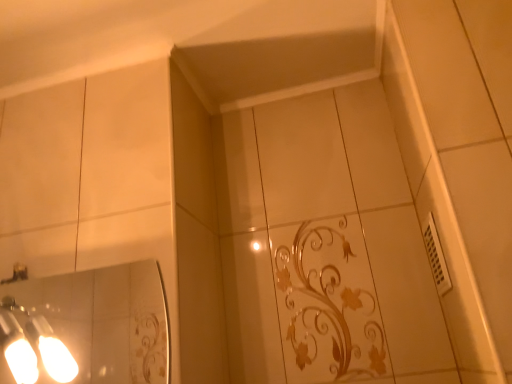
Describe the element at coordinates (436, 256) in the screenshot. The height and width of the screenshot is (384, 512). I see `white plastic vent at right` at that location.

Identify the location of white plastic vent at right. The width and height of the screenshot is (512, 384). (436, 256).

Describe the element at coordinates (31, 346) in the screenshot. I see `matte silver light fixture at left` at that location.

Where is `matte silver light fixture at left`? matte silver light fixture at left is located at coordinates (31, 346).

I want to click on white plastic vent at right, so click(x=436, y=256).

Considering the relative positions of white plastic vent at right and matte silver light fixture at left in the image provided, is white plastic vent at right to the left or to the right of matte silver light fixture at left?

From the image, it's evident that white plastic vent at right is to the right of matte silver light fixture at left.

Which object is further away from the camera taking this photo, white plastic vent at right or matte silver light fixture at left?

white plastic vent at right is more distant.

Which point is more forward, (x=435, y=227) or (x=53, y=359)?

The point (x=435, y=227) is more forward.

From the image's perspective, between white plastic vent at right and matte silver light fixture at left, who is located below?

From the image's view, matte silver light fixture at left is below.

From a real-world perspective, is white plastic vent at right on top of matte silver light fixture at left?

Correct, in the physical world, white plastic vent at right is higher than matte silver light fixture at left.

Can you confirm if white plastic vent at right is wider than matte silver light fixture at left?

No.

Can you confirm if white plastic vent at right is taller than matte silver light fixture at left?

No, white plastic vent at right is not taller than matte silver light fixture at left.

Does white plastic vent at right have a larger size compared to matte silver light fixture at left?

No, white plastic vent at right is not bigger than matte silver light fixture at left.

Is matte silver light fixture at left inside white plastic vent at right?

No.

Is white plastic vent at right positioned far away from matte silver light fixture at left?

No.

Is white plastic vent at right aimed at matte silver light fixture at left?

Yes, white plastic vent at right is oriented towards matte silver light fixture at left.

Can you tell me how much white plastic vent at right and matte silver light fixture at left differ in facing direction?

The angle between the facing direction of white plastic vent at right and the facing direction of matte silver light fixture at left is 88.4 degrees.

Looking at this image, how much distance is there between white plastic vent at right and matte silver light fixture at left?

white plastic vent at right and matte silver light fixture at left are 33.91 inches apart.

The height and width of the screenshot is (384, 512). Find the location of `electric outlet above the matte silver light fixture at left (from a real-world perspective)`. electric outlet above the matte silver light fixture at left (from a real-world perspective) is located at coordinates (436, 256).

Looking at this image, is matte silver light fixture at left to the left of white plastic vent at right from the viewer's perspective?

Yes.

Considering the positions of objects matte silver light fixture at left and white plastic vent at right in the image provided, who is behind, matte silver light fixture at left or white plastic vent at right?

Positioned behind is white plastic vent at right.

Is point (32, 365) more distant than point (432, 271)?

No.

From the image's perspective, would you say matte silver light fixture at left is shown under white plastic vent at right?

Indeed, from the image's perspective, matte silver light fixture at left is shown beneath white plastic vent at right.

From the picture: From a real-world perspective, who is located lower, matte silver light fixture at left or white plastic vent at right?

From a 3D spatial view, matte silver light fixture at left is below.

Is matte silver light fixture at left wider or thinner than white plastic vent at right?

Considering their sizes, matte silver light fixture at left looks broader than white plastic vent at right.

Who is taller, matte silver light fixture at left or white plastic vent at right?

With more height is matte silver light fixture at left.

Between matte silver light fixture at left and white plastic vent at right, which one has smaller size?

white plastic vent at right is smaller.

Would you say matte silver light fixture at left is outside white plastic vent at right?

Absolutely, matte silver light fixture at left is external to white plastic vent at right.

Is matte silver light fixture at left placed right next to white plastic vent at right?

matte silver light fixture at left is not next to white plastic vent at right, and they're not touching.

Is matte silver light fixture at left oriented towards white plastic vent at right?

No, matte silver light fixture at left is not turned towards white plastic vent at right.

How different are the orientations of matte silver light fixture at left and white plastic vent at right in degrees?

88.4 degrees.

At what (x,y) coordinates should I click in order to perform the action: click on electric outlet above the matte silver light fixture at left (from a real-world perspective). Please return your answer as a coordinate pair (x, y). Image resolution: width=512 pixels, height=384 pixels. Looking at the image, I should click on (436, 256).

You are a GUI agent. You are given a task and a screenshot of the screen. Output one action in this format:
    pyautogui.click(x=<x>, y=<y>)
    Task: Click on the electric outlet located behind the matte silver light fixture at left
    
    Given the screenshot: What is the action you would take?
    [436, 256]

Where is `electric outlet above the matte silver light fixture at left (from the image's perspective)`? The width and height of the screenshot is (512, 384). electric outlet above the matte silver light fixture at left (from the image's perspective) is located at coordinates (436, 256).